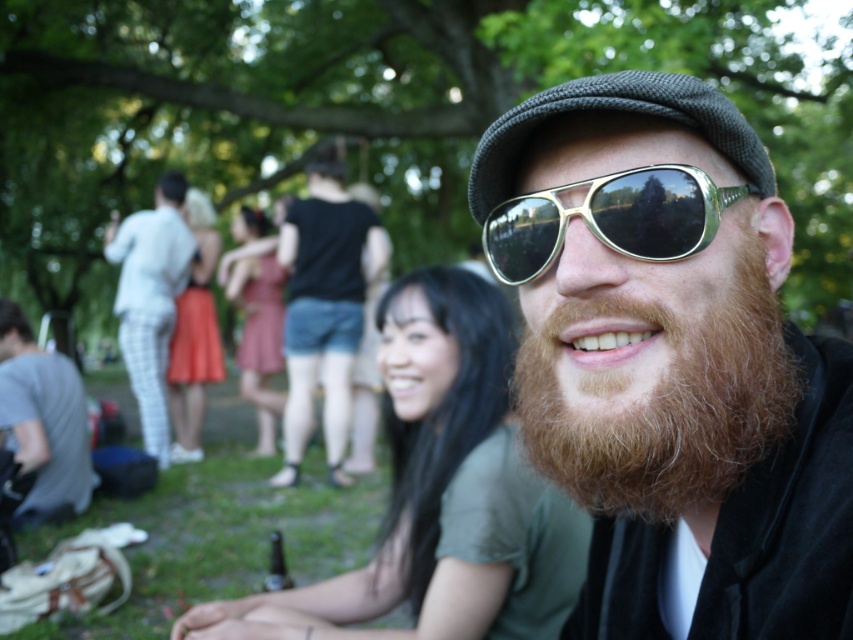
Question: Which point is closer to the camera?

Choices:
 (A) (527, 403)
 (B) (184, 260)
 (C) (602, 452)
 (D) (331, 248)

Answer: (C)

Question: Does gold reflective sunglasses at center have a greater width compared to white checkered pants at center?

Choices:
 (A) yes
 (B) no

Answer: (B)

Question: Which point is closer to the camera?

Choices:
 (A) gray cotton t-shirt at lower left
 (B) reddish-brown fuzzy beard at center

Answer: (B)

Question: Which object is farther from the camera taking this photo?

Choices:
 (A) green grass at lower center
 (B) white checkered pants at center
 (C) matte black cap at center

Answer: (B)

Question: Is black denim shorts at center to the left of gold reflective sunglasses at center from the viewer's perspective?

Choices:
 (A) yes
 (B) no

Answer: (A)

Question: Does gray cotton t-shirt at lower left appear on the right side of white checkered pants at center?

Choices:
 (A) no
 (B) yes

Answer: (B)